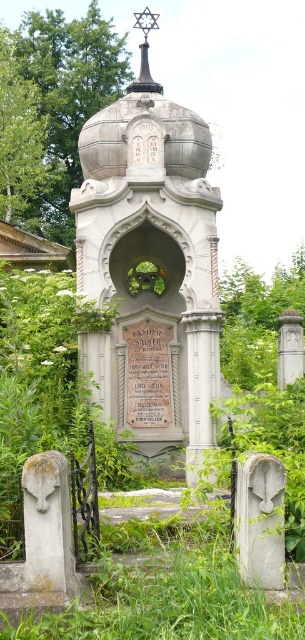
You are standing in front of the mausoleum and notice two green leafy trees in the upper part of the scene. Which tree is closer to you, the green leafy tree at upper center or the green leafy tree at upper left?

The green leafy tree at upper center is closer to you because the green leafy tree at upper left is behind it.

You are standing in front of the tombstone and want to take a photo. The camera is focused on the point at coordinates point (150,401). Will the point at coordinates point (32,84) be in focus as well?

Point (150,401) is closer to the camera than point (32,84). Therefore, if the camera is focused on point (150,401), the point (32,84) may not be in focus because it is further away from the camera.

Consider the image. You are a gardener planning to trim two green leafy trees in the cemetery. The green leafy tree at upper center and the green leafy tree at upper left are part of your task. If your ladder can reach up to 2 meters, can you safely trim both trees without moving the ladder?

The green leafy tree at upper center and green leafy tree at upper left are 2.43 meters apart from each other. Since the distance between them is greater than the ladder length of 2 meters, you will need to move the ladder to reach both trees safely.